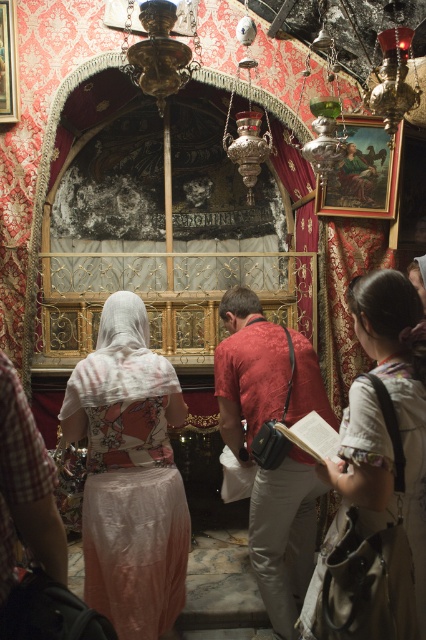
Between silky pink dress at center and pink silk dress at center, which one appears on the left side from the viewer's perspective?

pink silk dress at center is more to the left.

Where is `silky pink dress at center`? silky pink dress at center is located at coordinates (129, 474).

Based on the photo, is light beige fabric at center thinner than pink silk dress at center?

In fact, light beige fabric at center might be wider than pink silk dress at center.

Is point (347, 579) closer to camera compared to point (54, 547)?

No, it is behind (54, 547).

Is point (388, 586) positioned before point (0, 544)?

No, it is behind (0, 544).

Image resolution: width=426 pixels, height=640 pixels. What are the coordinates of `light beige fabric at center` in the screenshot? It's located at (377, 480).

Between light beige fabric at center and red fabric bag at center, which one has less height?

With less height is light beige fabric at center.

In the scene shown: Measure the distance between point (417, 630) and camera.

They are 2.45 meters apart.

You are a GUI agent. You are given a task and a screenshot of the screen. Output one action in this format:
    pyautogui.click(x=<x>, y=<y>)
    Task: Click on the light beige fabric at center
    Image resolution: width=426 pixels, height=640 pixels.
    Given the screenshot: What is the action you would take?
    click(x=377, y=480)